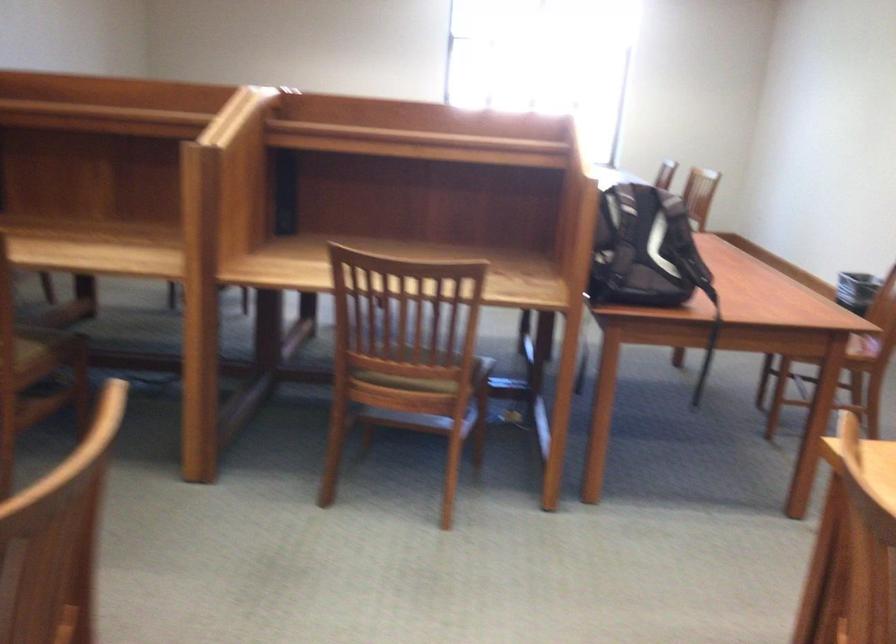
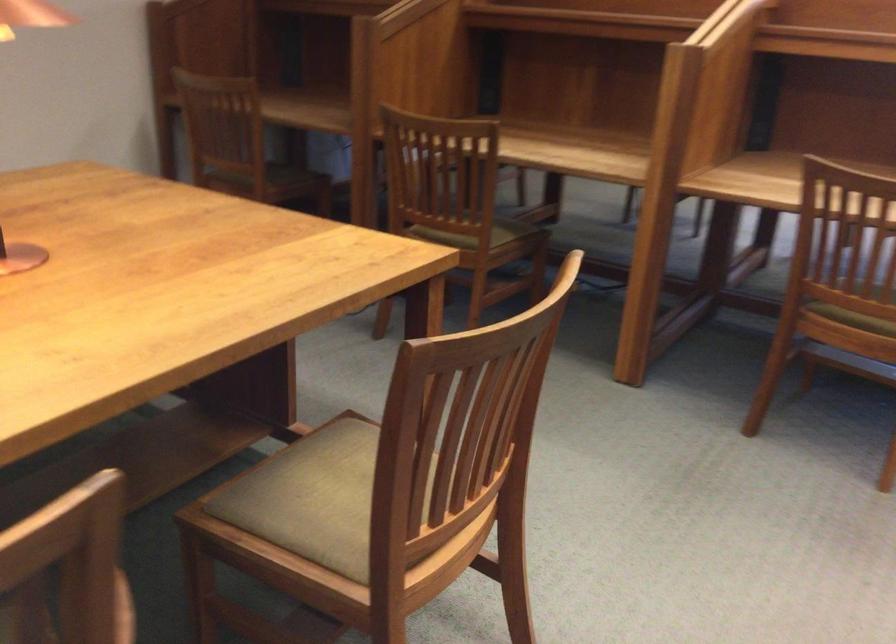
In the second image, find the point that corresponds to (x=389, y=381) in the first image.

(855, 313)